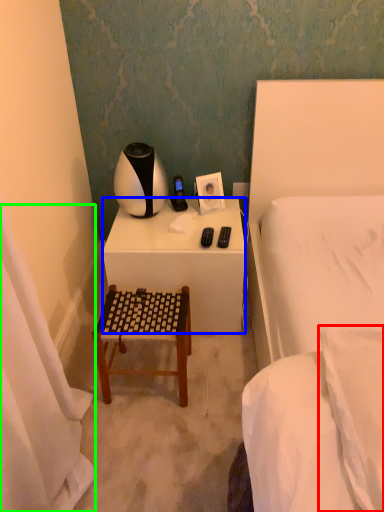
Question: Which object is positioned farthest from pillow (highlighted by a red box)? Select from desk (highlighted by a blue box) and curtain (highlighted by a green box).

Choices:
 (A) desk
 (B) curtain

Answer: (A)